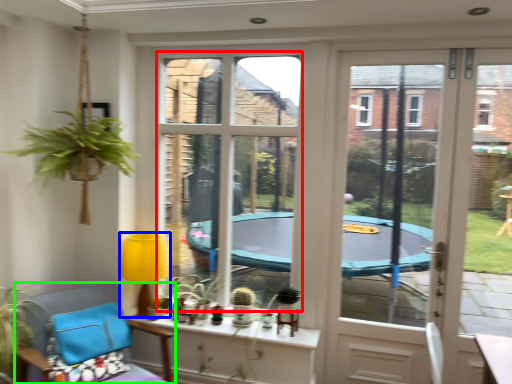
Question: Considering the real-world distances, which object is farthest from window screen (highlighted by a red box)? lamp (highlighted by a blue box) or chair (highlighted by a green box)?

Choices:
 (A) lamp
 (B) chair

Answer: (B)